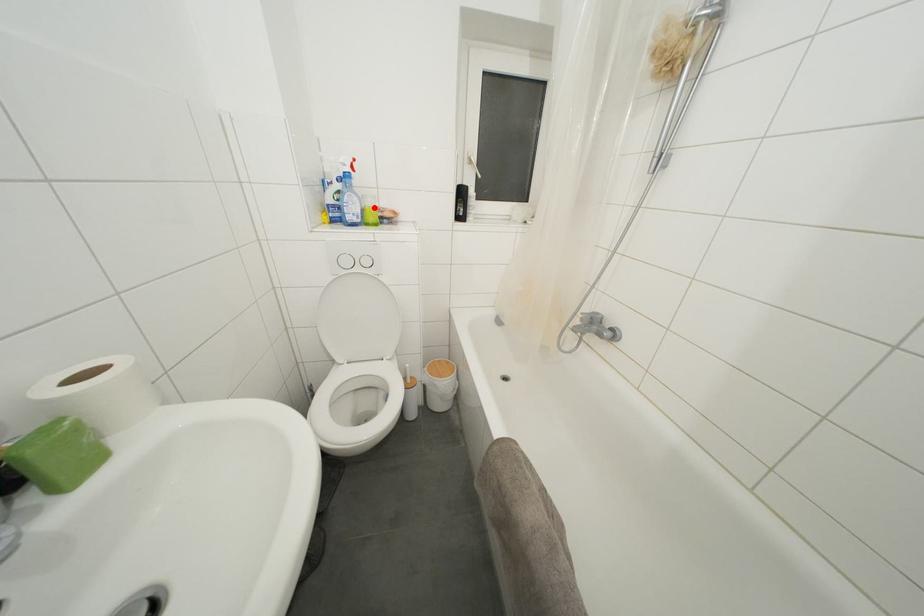
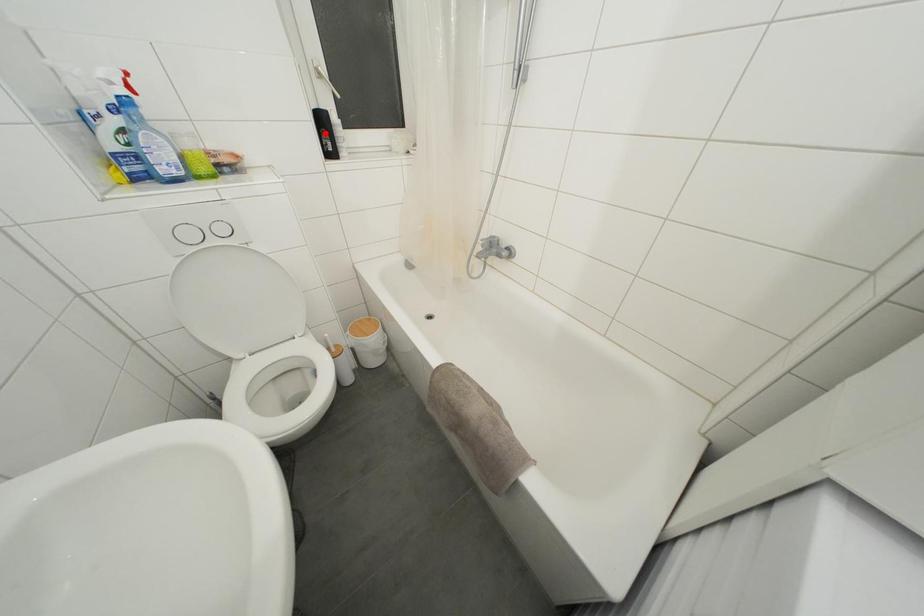
I am providing you with two images of the same scene from different viewpoints. A red point is marked on the first image and another point is marked on the second image. Is the marked point in image1 the same physical position as the marked point in image2?

No